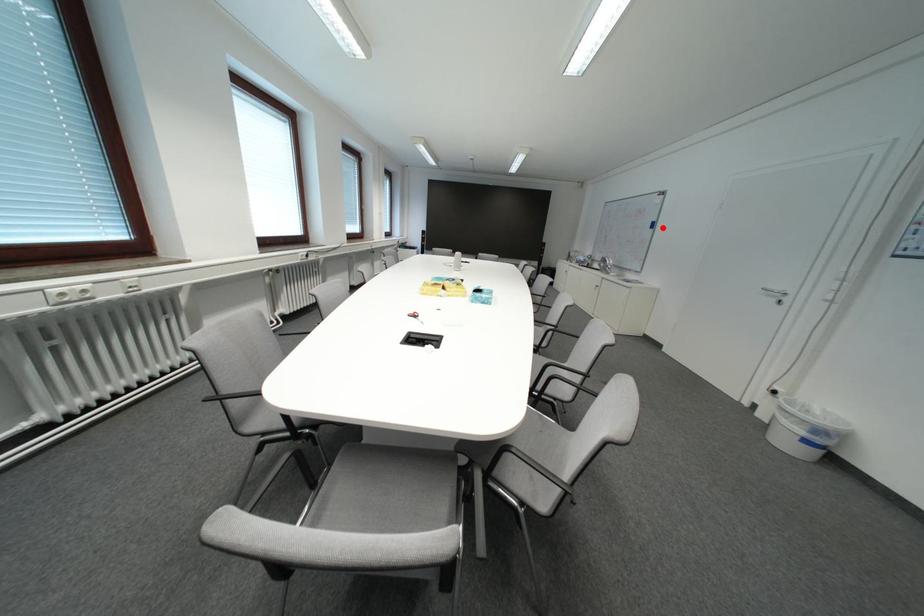
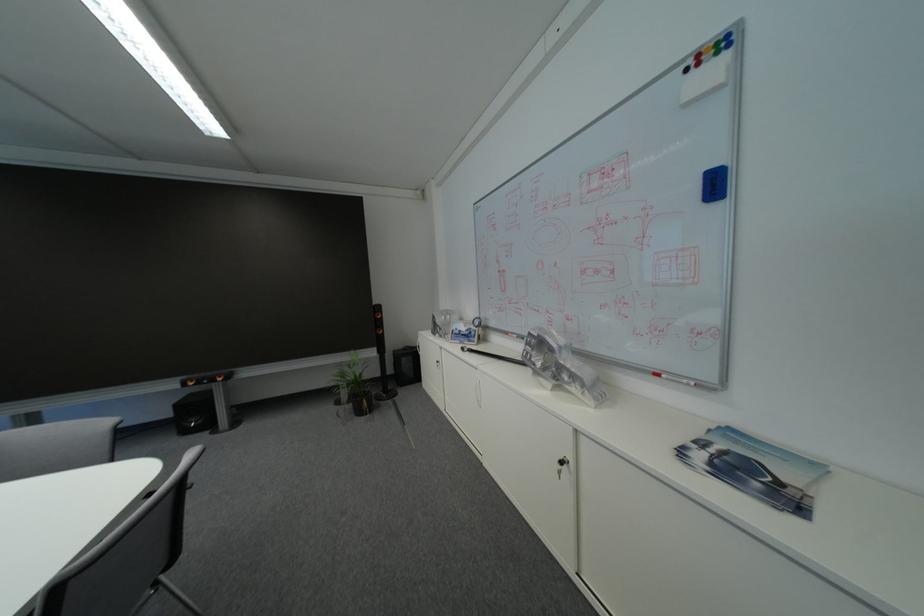
Locate, in the second image, the point that corresponds to the highlighted location in the first image.

(726, 188)